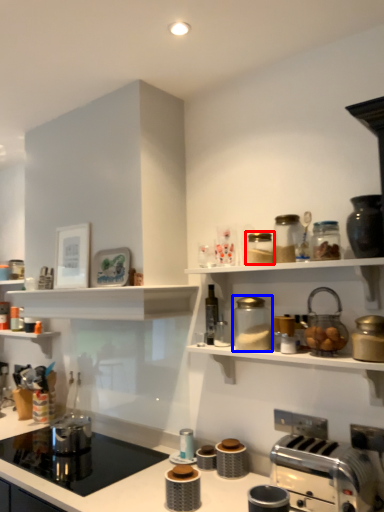
Question: Among these objects, which one is nearest to the camera, appliance (highlighted by a red box) or appliance (highlighted by a blue box)?

Choices:
 (A) appliance
 (B) appliance

Answer: (B)